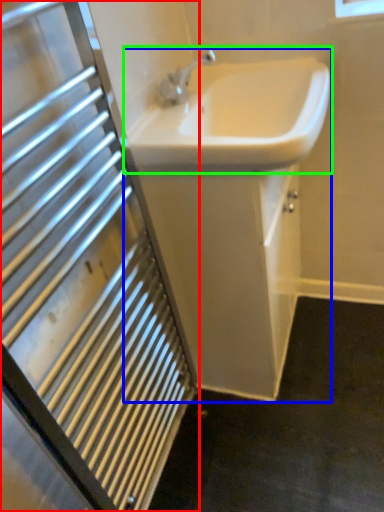
Question: Based on their relative distances, which object is farther from bathroom cabinet (highlighted by a red box)? Choose from sink (highlighted by a blue box) and sink (highlighted by a green box).

Choices:
 (A) sink
 (B) sink

Answer: (B)